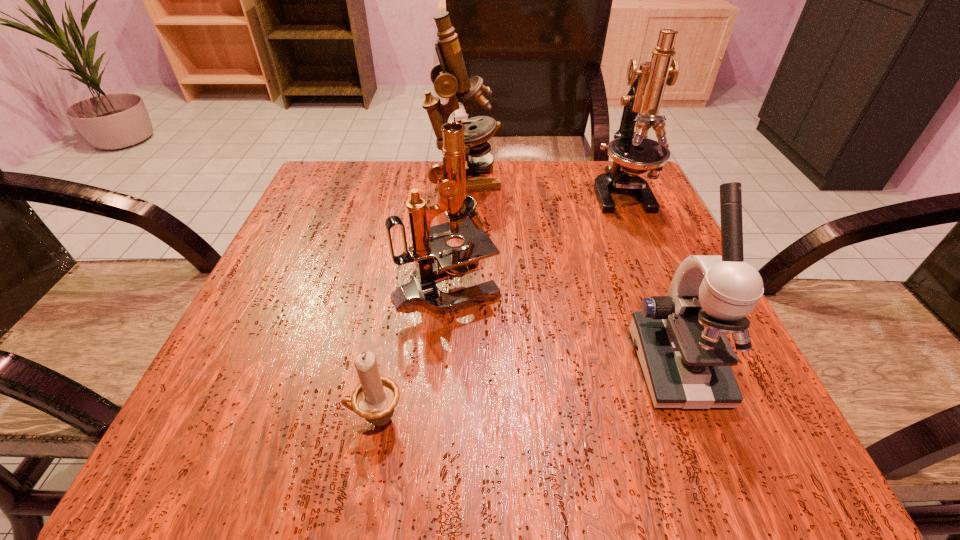
The width and height of the screenshot is (960, 540). I want to click on the second nearest microscope, so click(x=433, y=257).

The image size is (960, 540). Find the location of `the nearest microscope`. the nearest microscope is located at coordinates (686, 358).

Find the location of a particular element. candle_holder is located at coordinates (375, 397).

Locate an element on the screen. The image size is (960, 540). vacant region located at the eyepiece of the third nearest object is located at coordinates (652, 283).

I want to click on blank space located 0.080m on the handle side of the shortest object, so pyautogui.click(x=288, y=419).

The width and height of the screenshot is (960, 540). I want to click on vacant area located 0.120m on the handle side of the shortest object, so click(257, 419).

Locate an element on the screen. Image resolution: width=960 pixels, height=540 pixels. microscope present at the near edge is located at coordinates (686, 358).

The image size is (960, 540). In order to click on candle_holder at the near edge in this screenshot , I will do `click(375, 397)`.

Find the location of `object that is at the far right corner`. object that is at the far right corner is located at coordinates (633, 153).

Identify the location of object that is at the near right corner. (686, 358).